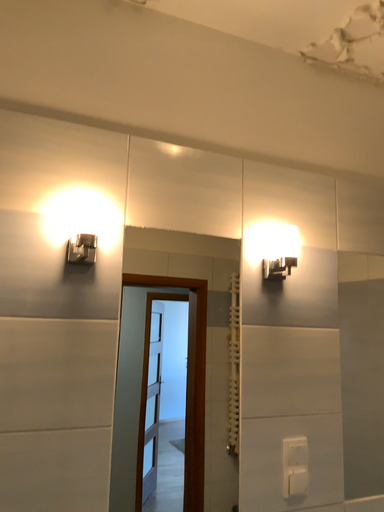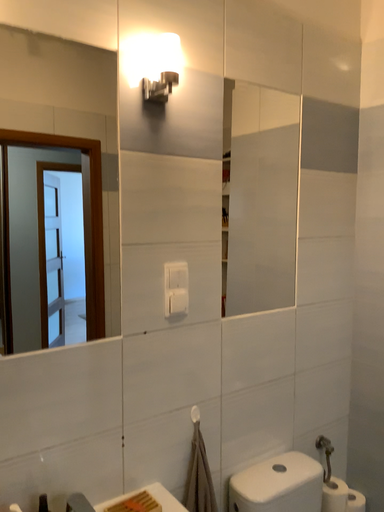
Question: Which way did the camera rotate in the video?

Choices:
 (A) rotated downward
 (B) rotated upward

Answer: (A)